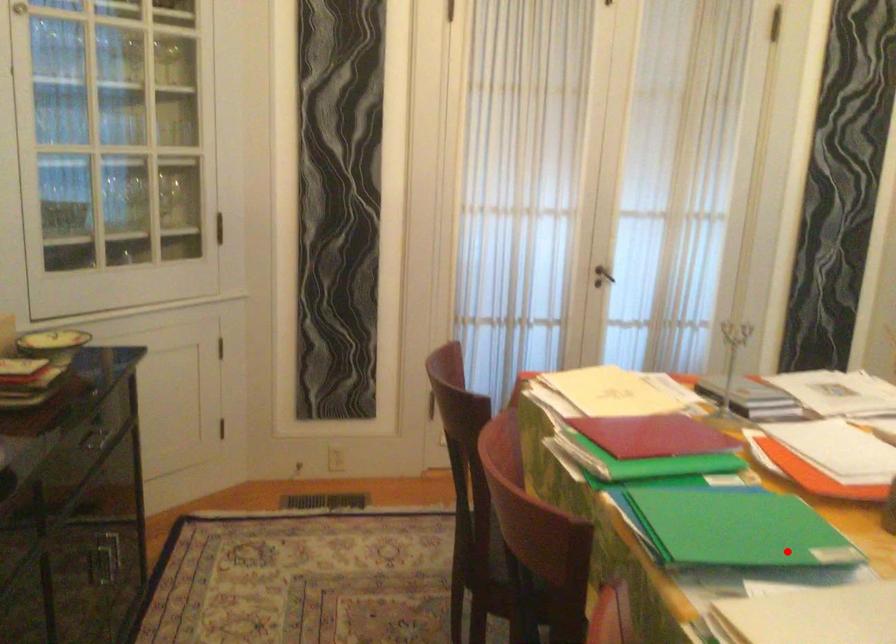
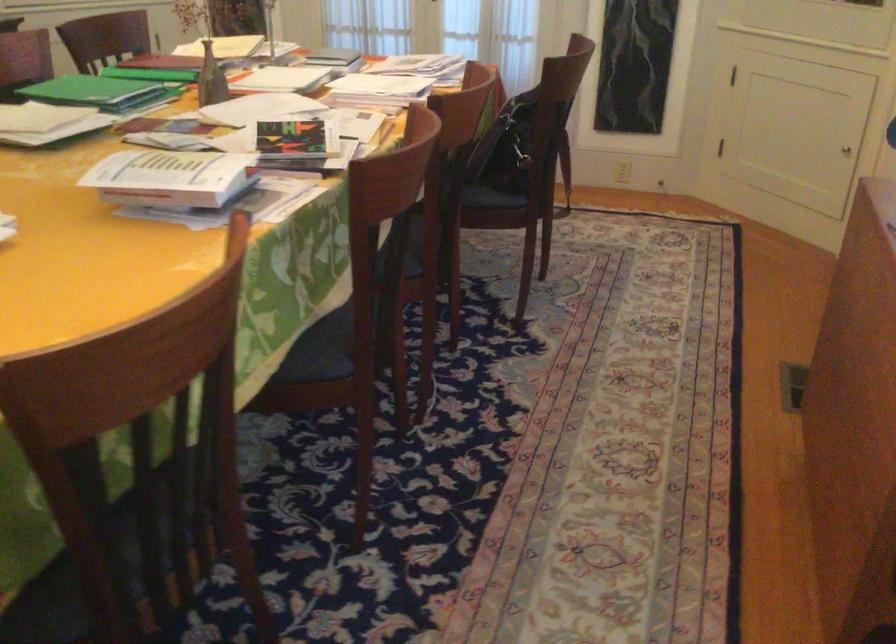
Question: I am providing you with two images of the same scene from different viewpoints. A red point is shown in image1. For the corresponding object point in image2, is it positioned nearer or farther from the camera?

Choices:
 (A) Nearer
 (B) Farther

Answer: (B)